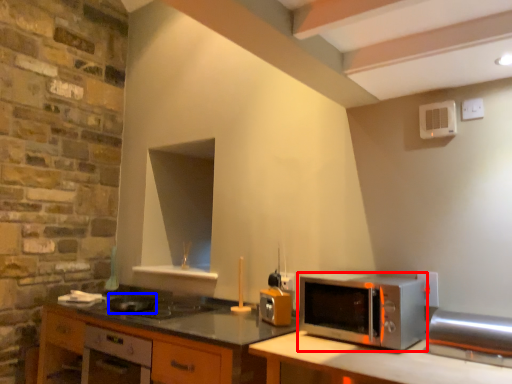
Question: Which object is closer to the camera taking this photo, microwave oven (highlighted by a red box) or appliance (highlighted by a blue box)?

Choices:
 (A) microwave oven
 (B) appliance

Answer: (A)